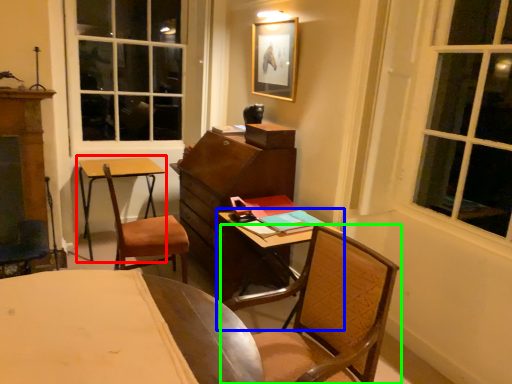
Question: Which object is positioned closest to round table (highlighted by a red box)? Select from table (highlighted by a blue box) and chair (highlighted by a green box).

Choices:
 (A) table
 (B) chair

Answer: (A)